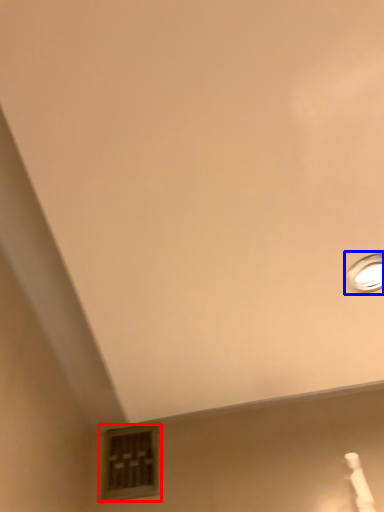
Question: Which object is further to the camera taking this photo, window (highlighted by a red box) or lamp (highlighted by a blue box)?

Choices:
 (A) window
 (B) lamp

Answer: (A)